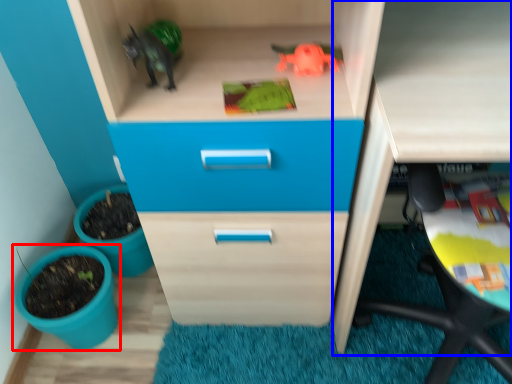
Question: Which point is closer to the camera, flowerpot (highlighted by a red box) or computer desk (highlighted by a blue box)?

Choices:
 (A) flowerpot
 (B) computer desk

Answer: (B)